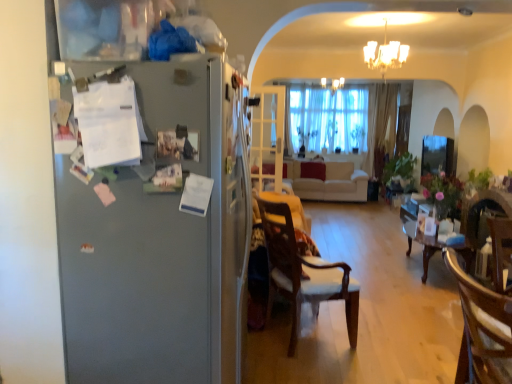
Question: Does white glass chandelier at upper center, the second light fixture positioned from the top, have a larger size compared to white glass door at center?

Choices:
 (A) yes
 (B) no

Answer: (A)

Question: Would you say white glass door at center is part of white glass chandelier at upper center, acting as the first light fixture starting from the front,'s contents?

Choices:
 (A) no
 (B) yes

Answer: (A)

Question: Is white glass chandelier at upper center, acting as the first light fixture starting from the front, taller than white glass door at center?

Choices:
 (A) no
 (B) yes

Answer: (A)

Question: Is white glass chandelier at upper center, the first light fixture in the bottom-to-top sequence, wider than white glass door at center?

Choices:
 (A) no
 (B) yes

Answer: (B)

Question: Can you see white glass chandelier at upper center, the first light fixture in the bottom-to-top sequence, touching white glass door at center?

Choices:
 (A) yes
 (B) no

Answer: (B)

Question: Considering the relative positions of wooden chair at lower right, the 2th chair viewed from the left, and white glass chandelier at upper center, the second light fixture positioned from the top, in the image provided, is wooden chair at lower right, the 2th chair viewed from the left, to the left or to the right of white glass chandelier at upper center, the second light fixture positioned from the top,?

Choices:
 (A) left
 (B) right

Answer: (A)

Question: Considering the positions of wooden chair at lower right, which ranks as the second chair in back-to-front order, and white glass chandelier at upper center, the first light fixture in the bottom-to-top sequence, in the image, is wooden chair at lower right, which ranks as the second chair in back-to-front order, wider or thinner than white glass chandelier at upper center, the first light fixture in the bottom-to-top sequence,?

Choices:
 (A) wide
 (B) thin

Answer: (B)

Question: From a real-world perspective, is wooden chair at lower right, which appears as the 1th chair when viewed from the front, above or below white glass chandelier at upper center, acting as the first light fixture starting from the front?

Choices:
 (A) above
 (B) below

Answer: (B)

Question: In the image, is wooden chair at lower right, the 2th chair viewed from the left, positioned in front of or behind white glass chandelier at upper center, acting as the second light fixture starting from the back?

Choices:
 (A) front
 (B) behind

Answer: (A)

Question: Looking at their shapes, would you say white glass chandelier at upper center, placed as the 2th light fixture when sorted from bottom to top, is wider or thinner than white glass door at center?

Choices:
 (A) wide
 (B) thin

Answer: (A)

Question: Considering the positions of white glass chandelier at upper center, the second light fixture viewed from the front, and white glass door at center in the image, is white glass chandelier at upper center, the second light fixture viewed from the front, bigger or smaller than white glass door at center?

Choices:
 (A) small
 (B) big

Answer: (A)

Question: From a real-world perspective, is white glass chandelier at upper center, the second light fixture viewed from the front, physically located above or below white glass door at center?

Choices:
 (A) below
 (B) above

Answer: (B)

Question: Is point (331, 89) closer or farther from the camera than point (270, 168)?

Choices:
 (A) closer
 (B) farther

Answer: (B)

Question: Is satin silver refrigerator at left bigger or smaller than white glass chandelier at upper center, the second light fixture viewed from the front?

Choices:
 (A) small
 (B) big

Answer: (B)

Question: Considering their positions, is satin silver refrigerator at left located in front of or behind white glass chandelier at upper center, the second light fixture viewed from the front?

Choices:
 (A) behind
 (B) front

Answer: (B)